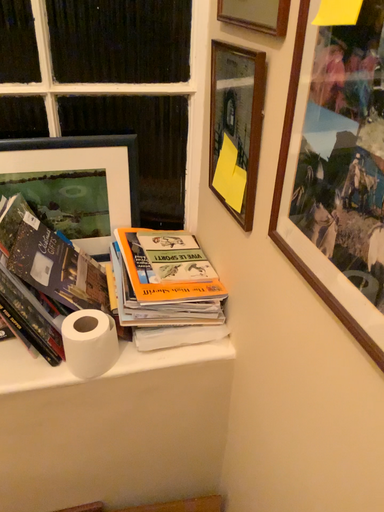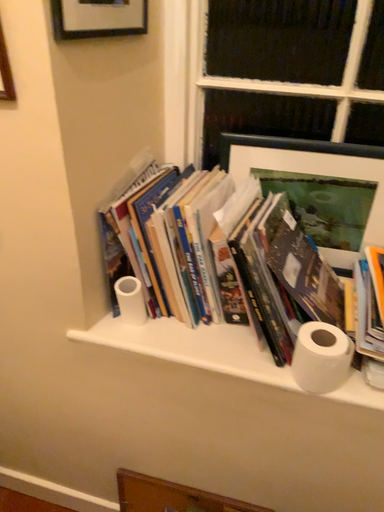
Question: How did the camera likely rotate when shooting the video?

Choices:
 (A) rotated left
 (B) rotated right

Answer: (A)